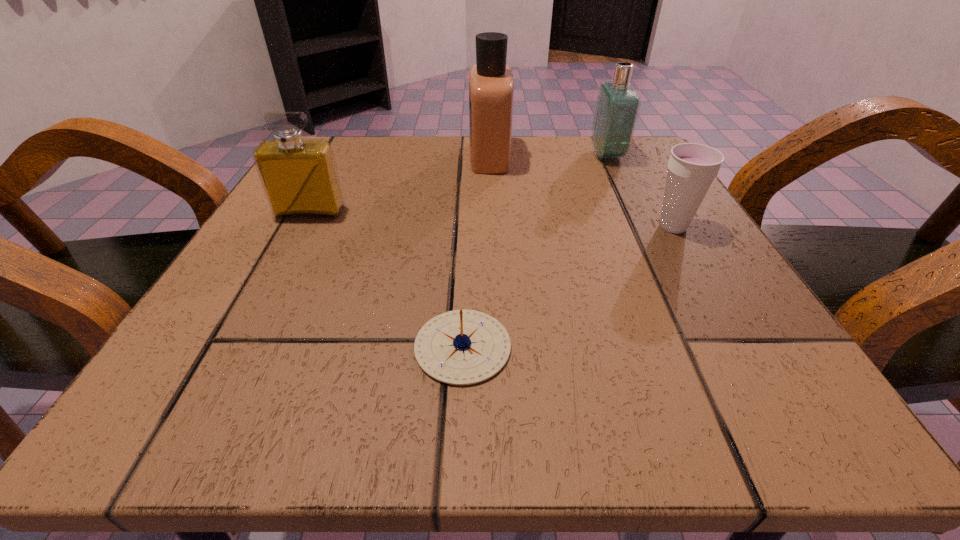
Where is `cup that is at the right edge`? This screenshot has width=960, height=540. cup that is at the right edge is located at coordinates (692, 167).

This screenshot has height=540, width=960. I want to click on object at the far right corner, so click(617, 107).

Where is `free space at the far edge`? This screenshot has height=540, width=960. free space at the far edge is located at coordinates (459, 166).

Locate an element on the screen. blank space at the near edge of the desktop is located at coordinates (420, 369).

Locate an element on the screen. vacant position at the left edge of the desktop is located at coordinates (320, 231).

The height and width of the screenshot is (540, 960). Identify the location of vacant space at the right edge of the desktop. (648, 194).

Locate an element on the screen. This screenshot has height=540, width=960. vacant area at the far left corner of the desktop is located at coordinates (334, 137).

Image resolution: width=960 pixels, height=540 pixels. Identify the location of vacant space at the near left corner of the desktop. (304, 363).

I want to click on free space at the far right corner, so click(612, 165).

Find the location of a particular element. The height and width of the screenshot is (540, 960). empty space that is in between the cup and the tallest object is located at coordinates (582, 191).